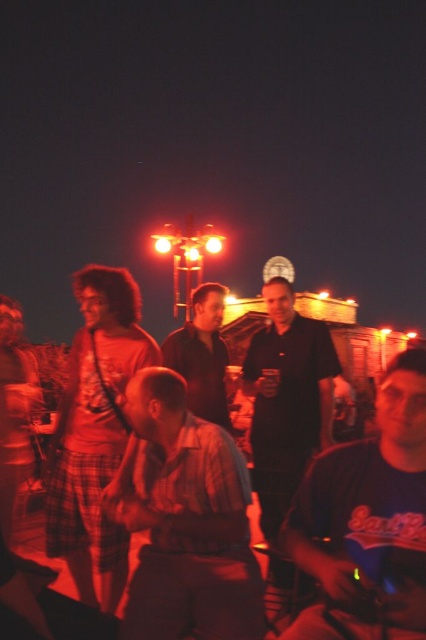
You are at a nighttime gathering and want to find the person wearing the matte red shirt at center. Which direction should you look relative to the dark brown leather jacket at center?

The matte red shirt at center is closer to the viewer than the dark brown leather jacket at center, so you should look towards the front direction relative to the dark brown leather jacket at center.

You are organizing a photo shoot and need to ensure that the matte red shirt at center and the dark brown leather jacket at center will fit within a 3ft wide backdrop. Based on their sizes, will both items fit side by side?

The matte red shirt at center is wider than the dark brown leather jacket at center. However, without knowing the exact widths of both items, it is impossible to determine if they will fit within the 3ft backdrop together.